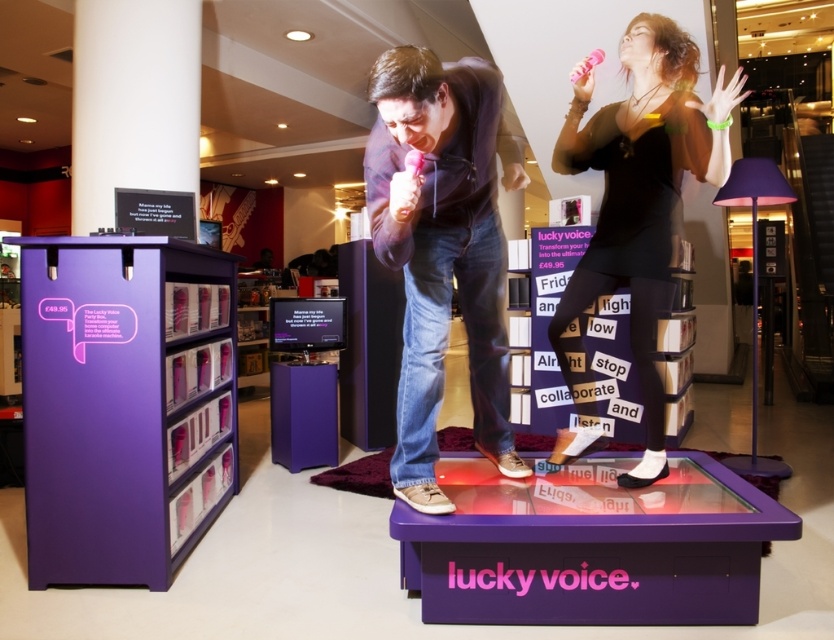
You are a customer in the store and want to grab both the matte black microphone at center and the black matte dress at center. Which one is on the left side?

The matte black microphone at center is positioned on the left side of the black matte dress at center, so the microphone is on the left.

You are a customer in the store and want to examine both the purple matte bookshelf at left and the black matte dress at center. Which item should you approach first if you are standing in the middle of the store?

You should approach the purple matte bookshelf at left first because it is positioned to the left of the black matte dress at center, making it closer to your current position in the middle of the store.